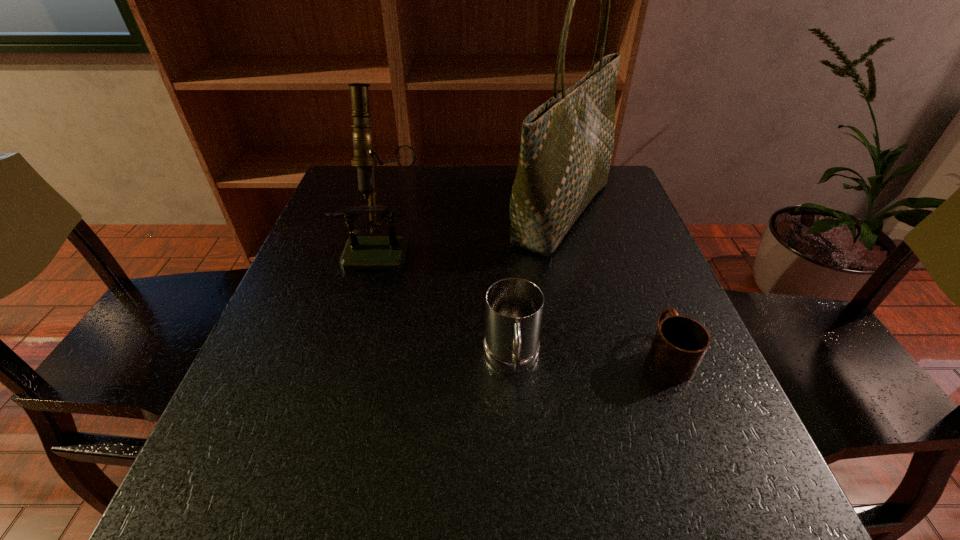
You are a GUI agent. You are given a task and a screenshot of the screen. Output one action in this format:
    pyautogui.click(x=<x>, y=<y>)
    Task: Click on the free location located 0.160m on the side of the right mug with the handle
    
    Given the screenshot: What is the action you would take?
    pyautogui.click(x=636, y=273)

Identify the location of free point located 0.270m on the side of the right mug with the handle. Image resolution: width=960 pixels, height=540 pixels. (623, 241).

Locate an element on the screen. The width and height of the screenshot is (960, 540). vacant space located 0.150m on the side of the right mug with the handle is located at coordinates (636, 275).

Locate an element on the screen. This screenshot has height=540, width=960. object that is positioned at the far edge is located at coordinates (567, 143).

Locate an element on the screen. object that is at the left edge is located at coordinates (390, 252).

Identify the location of shopping bag located in the right edge section of the desktop. (567, 143).

Locate an element on the screen. mug present at the right edge is located at coordinates (680, 343).

Find the location of a particular element. object present at the far right corner is located at coordinates click(x=567, y=143).

Locate an element on the screen. vacant space at the far edge of the desktop is located at coordinates (495, 204).

You are a GUI agent. You are given a task and a screenshot of the screen. Output one action in this format:
    pyautogui.click(x=<x>, y=<y>)
    Task: Click on the vacant space at the near edge of the desktop
    This screenshot has width=960, height=540.
    Given the screenshot: What is the action you would take?
    pyautogui.click(x=313, y=498)